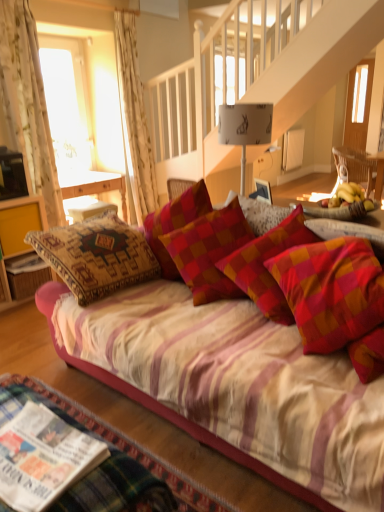
Question: Does white floral fabric curtain at upper left, the second curtain viewed from the left, appear on the left side of white glossy magazine at lower left, which is counted as the first magazine, starting from the left?

Choices:
 (A) yes
 (B) no

Answer: (B)

Question: Considering the relative sizes of white floral fabric curtain at upper left, the first curtain when ordered from back to front, and white glossy magazine at lower left, arranged as the first magazine when viewed from the back, in the image provided, is white floral fabric curtain at upper left, the first curtain when ordered from back to front, bigger than white glossy magazine at lower left, arranged as the first magazine when viewed from the back,?

Choices:
 (A) no
 (B) yes

Answer: (B)

Question: From a real-world perspective, is white floral fabric curtain at upper left, the second curtain viewed from the left, physically above white glossy magazine at lower left, arranged as the first magazine when viewed from the back?

Choices:
 (A) no
 (B) yes

Answer: (B)

Question: From the image's perspective, is white floral fabric curtain at upper left, which ranks as the 1th curtain in right-to-left order, located beneath white glossy magazine at lower left, arranged as the 2th magazine when viewed from the front?

Choices:
 (A) yes
 (B) no

Answer: (B)

Question: Is white floral fabric curtain at upper left, the second curtain viewed from the left, not close to white glossy magazine at lower left, the first magazine from the top?

Choices:
 (A) no
 (B) yes

Answer: (B)

Question: Considering the positions of yellow wood cabinet at left and printed paper magazine at lower left, arranged as the 2th magazine when viewed from the top, in the image, is yellow wood cabinet at left taller or shorter than printed paper magazine at lower left, arranged as the 2th magazine when viewed from the top,?

Choices:
 (A) short
 (B) tall

Answer: (B)

Question: Is yellow wood cabinet at left bigger or smaller than printed paper magazine at lower left, the 2th magazine when ordered from left to right?

Choices:
 (A) small
 (B) big

Answer: (B)

Question: Considering the positions of point (3, 256) and point (34, 421), is point (3, 256) closer or farther from the camera than point (34, 421)?

Choices:
 (A) farther
 (B) closer

Answer: (A)

Question: From the image's perspective, is yellow wood cabinet at left above or below printed paper magazine at lower left, marked as the 1th magazine in a right-to-left arrangement?

Choices:
 (A) below
 (B) above

Answer: (B)

Question: From a real-world perspective, is printed paper magazine at lower left, which ranks as the 1th magazine in front-to-back order, physically located above or below silky pink couch at center?

Choices:
 (A) above
 (B) below

Answer: (A)

Question: Is point (31, 401) closer or farther from the camera than point (144, 335)?

Choices:
 (A) farther
 (B) closer

Answer: (B)

Question: Looking at the image, does printed paper magazine at lower left, placed as the first magazine when sorted from bottom to top, seem bigger or smaller compared to silky pink couch at center?

Choices:
 (A) big
 (B) small

Answer: (B)

Question: In the image, is printed paper magazine at lower left, arranged as the 2th magazine when viewed from the top, on the left side or the right side of silky pink couch at center?

Choices:
 (A) left
 (B) right

Answer: (A)

Question: Based on their positions, is wooden chair at right located to the left or right of silky pink couch at center?

Choices:
 (A) right
 (B) left

Answer: (A)

Question: From the image's perspective, is wooden chair at right above or below silky pink couch at center?

Choices:
 (A) below
 (B) above

Answer: (B)